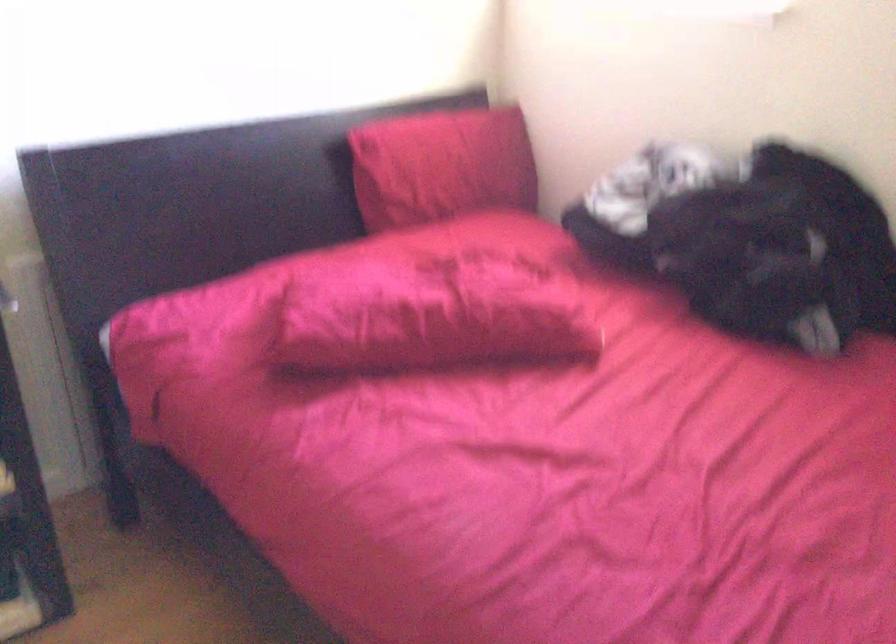
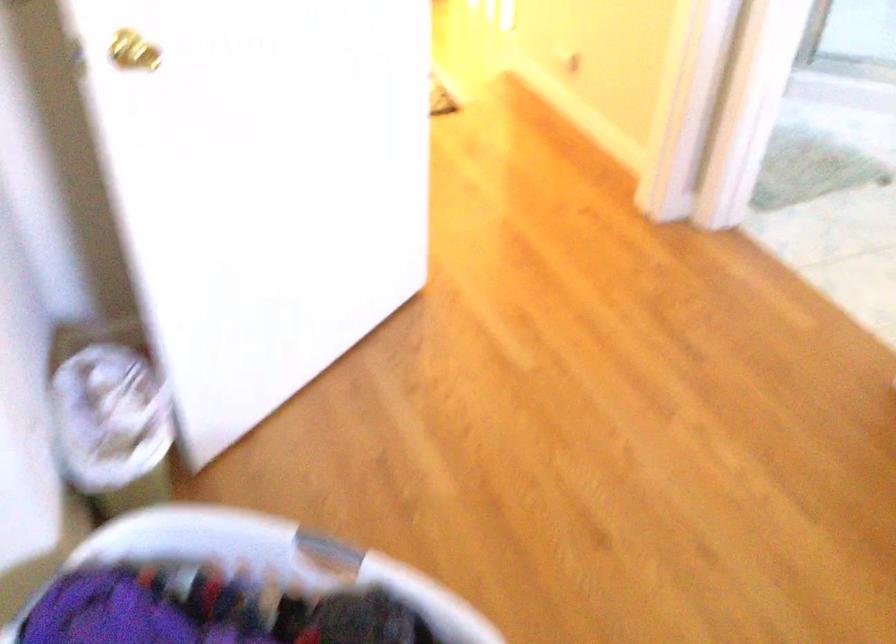
How did the camera likely rotate?

The camera rotated toward left-down.